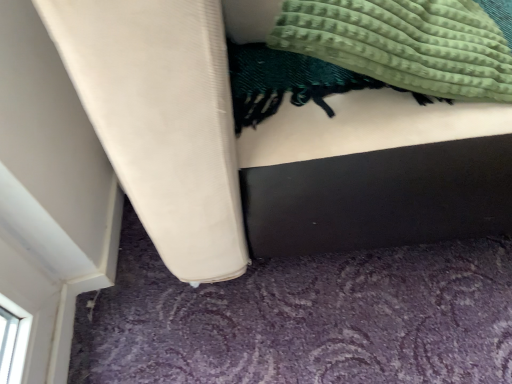
Question: Considering the relative sizes of green textured blanket at upper right and matte white bed at center in the image provided, is green textured blanket at upper right shorter than matte white bed at center?

Choices:
 (A) no
 (B) yes

Answer: (B)

Question: From the image's perspective, does green textured blanket at upper right appear lower than matte white bed at center?

Choices:
 (A) yes
 (B) no

Answer: (A)

Question: Is green textured blanket at upper right beside matte white bed at center?

Choices:
 (A) no
 (B) yes

Answer: (A)

Question: Is green textured blanket at upper right further to the viewer compared to matte white bed at center?

Choices:
 (A) yes
 (B) no

Answer: (A)

Question: Is green textured blanket at upper right facing towards matte white bed at center?

Choices:
 (A) no
 (B) yes

Answer: (B)

Question: Is green textured blanket at upper right positioned in front of matte white bed at center?

Choices:
 (A) yes
 (B) no

Answer: (B)

Question: Is green textured blanket at upper right located within matte white bed at center?

Choices:
 (A) no
 (B) yes

Answer: (B)

Question: From the image's perspective, does matte white bed at center appear lower than green textured blanket at upper right?

Choices:
 (A) yes
 (B) no

Answer: (B)

Question: Is matte white bed at center taller than green textured blanket at upper right?

Choices:
 (A) yes
 (B) no

Answer: (A)

Question: Is green textured blanket at upper right at the back of matte white bed at center?

Choices:
 (A) no
 (B) yes

Answer: (B)

Question: Does matte white bed at center appear on the left side of green textured blanket at upper right?

Choices:
 (A) no
 (B) yes

Answer: (A)

Question: Does matte white bed at center come behind green textured blanket at upper right?

Choices:
 (A) no
 (B) yes

Answer: (A)

Question: In terms of width, does green textured blanket at upper right look wider or thinner when compared to matte white bed at center?

Choices:
 (A) thin
 (B) wide

Answer: (A)